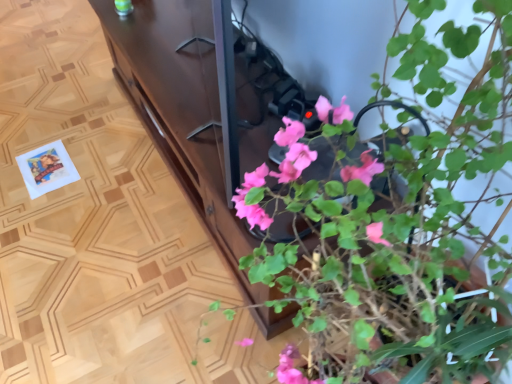
Identify the location of pink matte plant at center. (399, 222).

This screenshot has height=384, width=512. Describe the element at coordinates (399, 222) in the screenshot. I see `pink matte plant at center` at that location.

Measure the distance between pink matte plant at center and camera.

17.83 inches.

This screenshot has width=512, height=384. I want to click on pink matte plant at center, so click(399, 222).